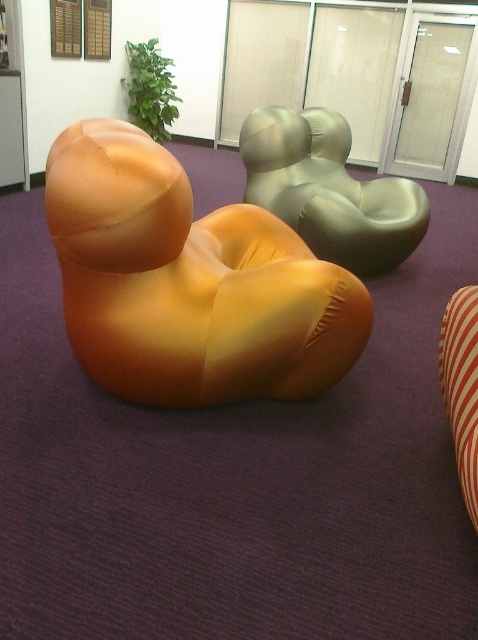
Is point (153, 195) positioned behind point (324, 220)?

That is False.

At what (x,y) coordinates should I click in order to perform the action: click on matte orange bean bag at center. Please return your answer as a coordinate pair (x, y). Looking at the image, I should click on (188, 282).